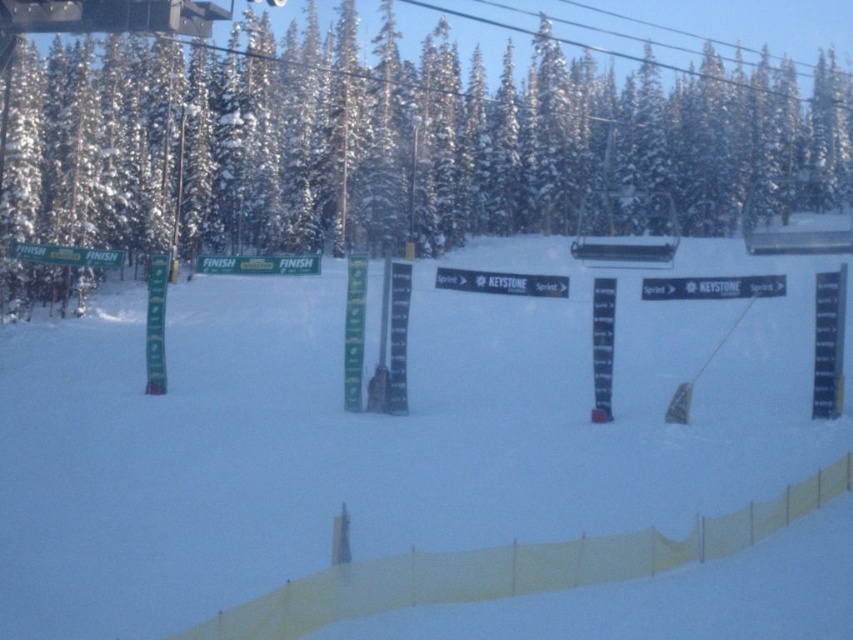
In the scene shown: Does white snow ski slope at center appear over white snow-covered tree at center?

Actually, white snow ski slope at center is below white snow-covered tree at center.

Between white snow ski slope at center and white snow-covered tree at center, which one is positioned higher?

white snow-covered tree at center

The image size is (853, 640). What do you see at coordinates (376, 433) in the screenshot? I see `white snow ski slope at center` at bounding box center [376, 433].

Find the location of `white snow ski slope at center`. white snow ski slope at center is located at coordinates (376, 433).